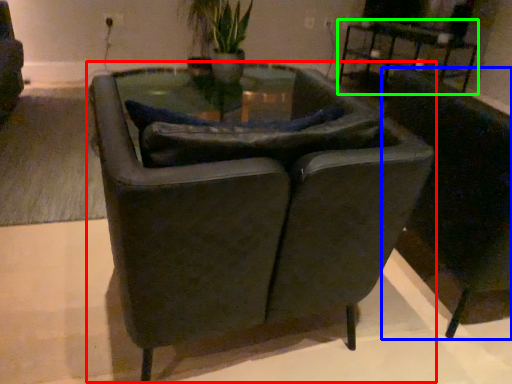
Question: Which object is the farthest from chair (highlighted by a red box)? Choose among these: chair (highlighted by a blue box) or table (highlighted by a green box).

Choices:
 (A) chair
 (B) table

Answer: (B)